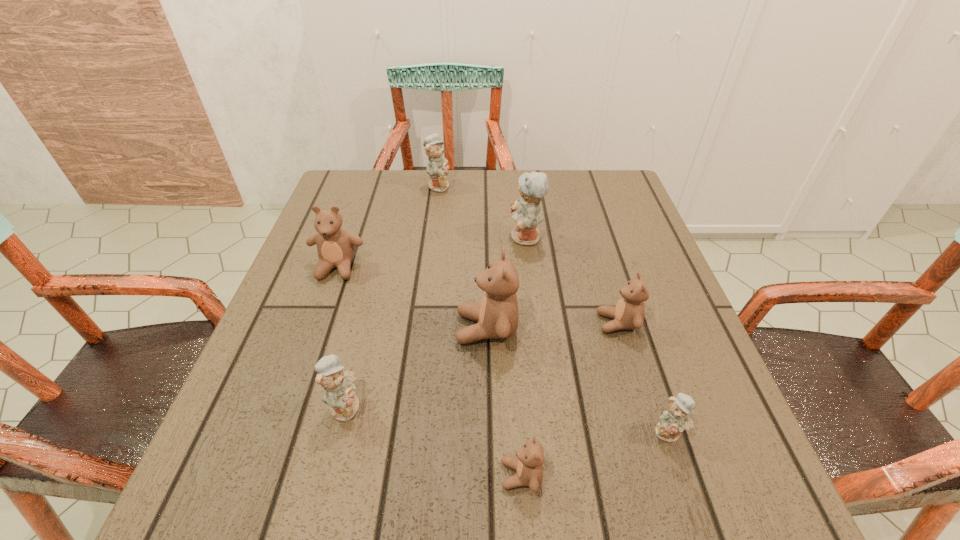
The height and width of the screenshot is (540, 960). Identify the location of free space located on the front-facing side of the sixth nearest teddy bear. (298, 381).

The width and height of the screenshot is (960, 540). Identify the location of vacant point located on the front-facing side of the leftmost blue teddy bear. (571, 406).

Where is `vacant area located 0.310m on the front-facing side of the second smallest brown teddy bear`? The image size is (960, 540). vacant area located 0.310m on the front-facing side of the second smallest brown teddy bear is located at coordinates (442, 323).

In order to click on free space located 0.300m on the front-facing side of the second smallest brown teddy bear in this screenshot , I will do `click(446, 323)`.

The width and height of the screenshot is (960, 540). Identify the location of free space located on the front-facing side of the second smallest brown teddy bear. (487, 323).

Locate an element on the screen. The width and height of the screenshot is (960, 540). vacant region located on the front-facing side of the smallest blue teddy bear is located at coordinates (688, 490).

In order to click on vacant space situated 0.240m on the front-facing side of the smallest brown teddy bear in this screenshot , I will do `click(340, 475)`.

Where is `free space located on the front-facing side of the smallest brown teddy bear`? The image size is (960, 540). free space located on the front-facing side of the smallest brown teddy bear is located at coordinates (313, 475).

Identify the location of vacant space located 0.250m on the front-facing side of the smallest brown teddy bear. Image resolution: width=960 pixels, height=540 pixels. (333, 475).

Locate an element on the screen. This screenshot has height=540, width=960. object present at the far edge is located at coordinates click(x=437, y=168).